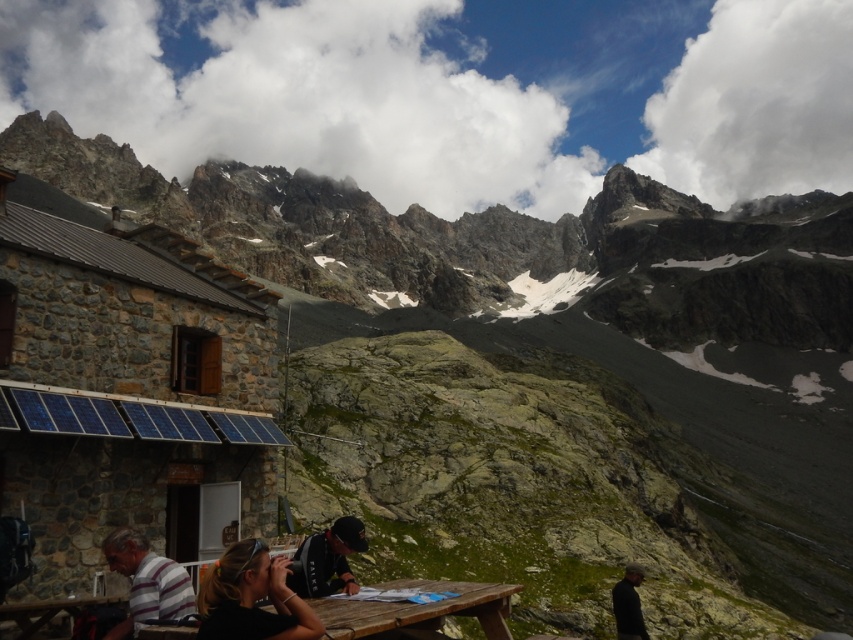
You are a photographer trying to capture the scene of the rustic stone building with the solar panels. You notice two black objects in the lower part of your frame. Which one is larger in size between the black hair at lower center and the black fabric at lower right?

The black hair at lower center is bigger than the black fabric at lower right, so the black hair at lower center is larger in size.

You are standing at the point marked by coordinates point [434,625] and want to walk towards the point marked by coordinates point [621,596]. Based on the scene description, will you be moving towards the rustic stone building or away from it?

Since point [434,625] is in front of point [621,596], moving from point [434,625] towards point [621,596] means you are moving away from the rustic stone building.